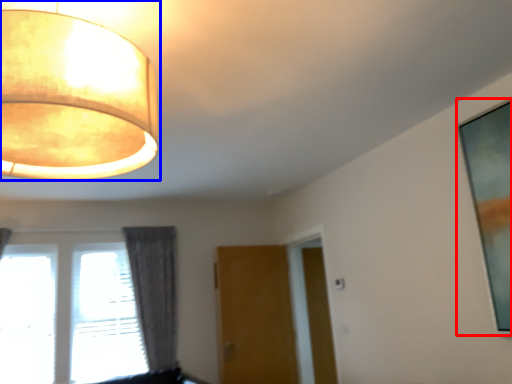
Question: Which of the following is the farthest to the observer, picture frame (highlighted by a red box) or lamp (highlighted by a blue box)?

Choices:
 (A) picture frame
 (B) lamp

Answer: (A)